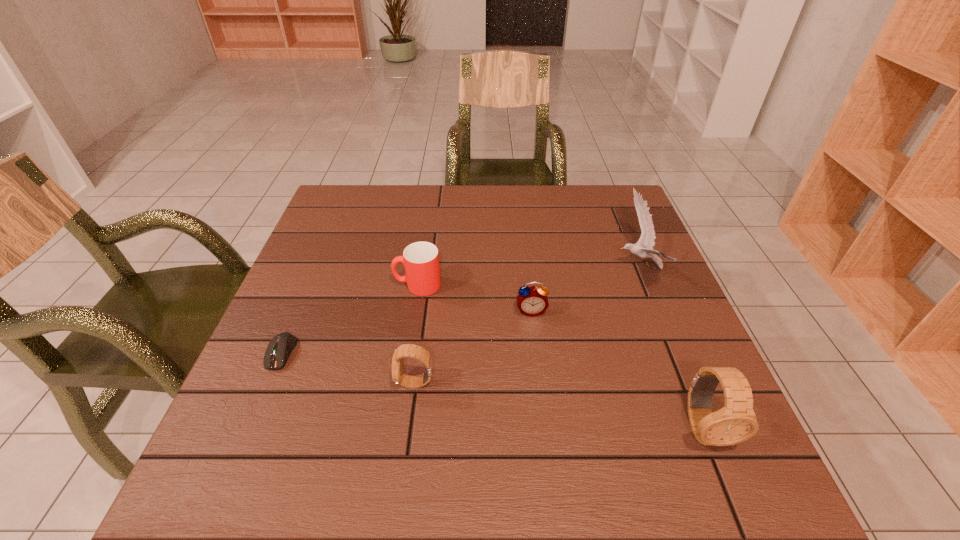
If we want them evenly spaced by inserting an extra watch among them, please locate a free spot for this new watch. Please provide its 2D coordinates. Your answer should be formatted as a tuple, i.e. [(x, y)], where the tuple contains the x and y coordinates of a point satisfying the conditions above.

[(553, 404)]